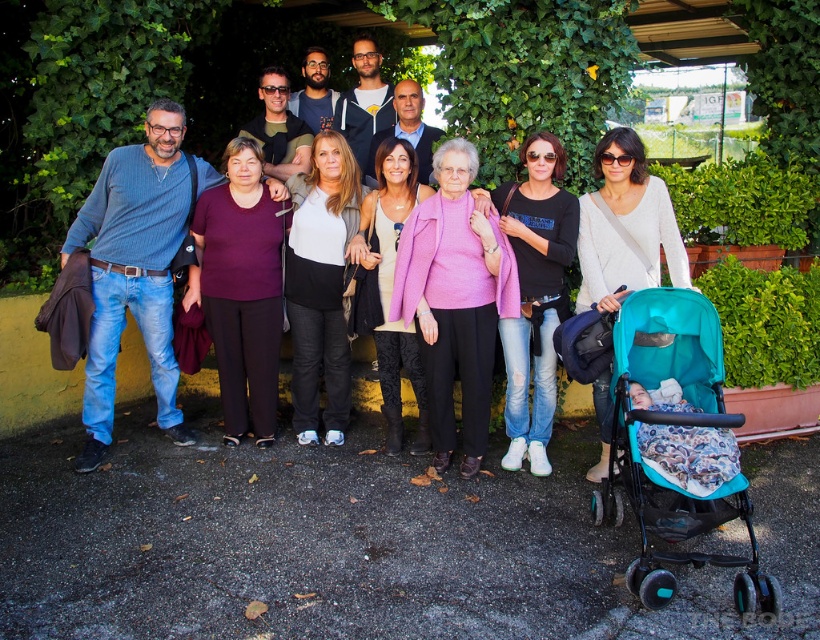
Is teal fabric stroller at lower right shorter than matte black stroller at lower right?

Yes.

Is the position of teal fabric stroller at lower right less distant than that of matte black stroller at lower right?

That is True.

Is point (618, 515) positioned in front of point (626, 132)?

Yes.

Identify the location of teal fabric stroller at lower right. This screenshot has height=640, width=820. coord(680,428).